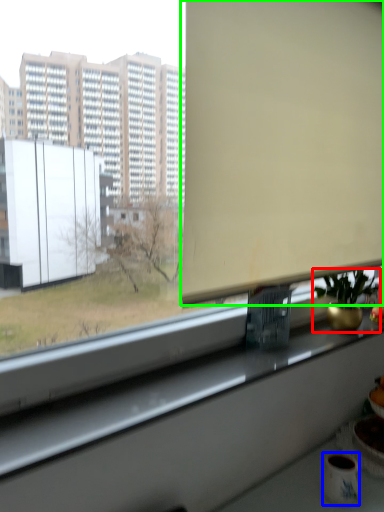
Question: Which object is the closest to the houseplant (highlighted by a red box)? Choose among these: mug (highlighted by a blue box) or window screen (highlighted by a green box).

Choices:
 (A) mug
 (B) window screen

Answer: (B)